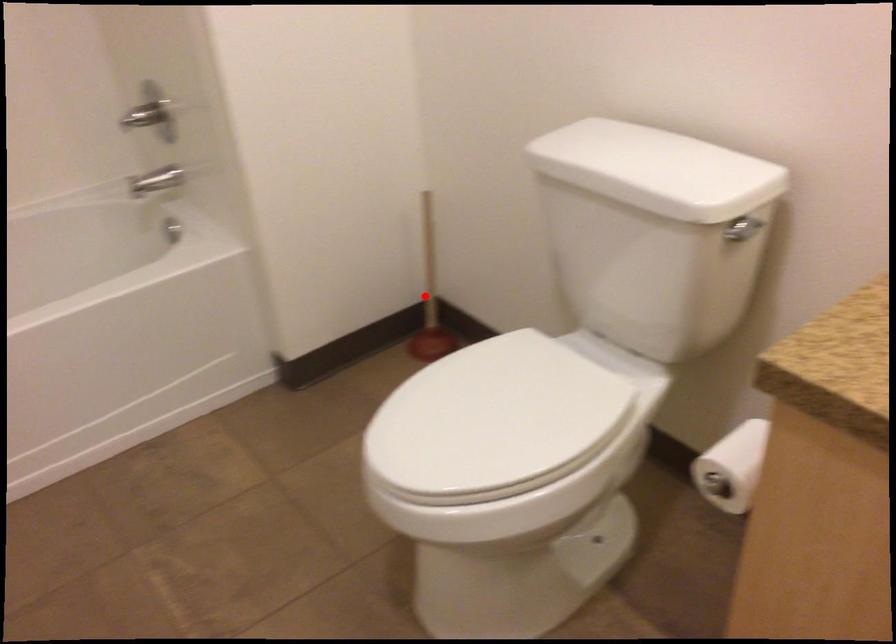
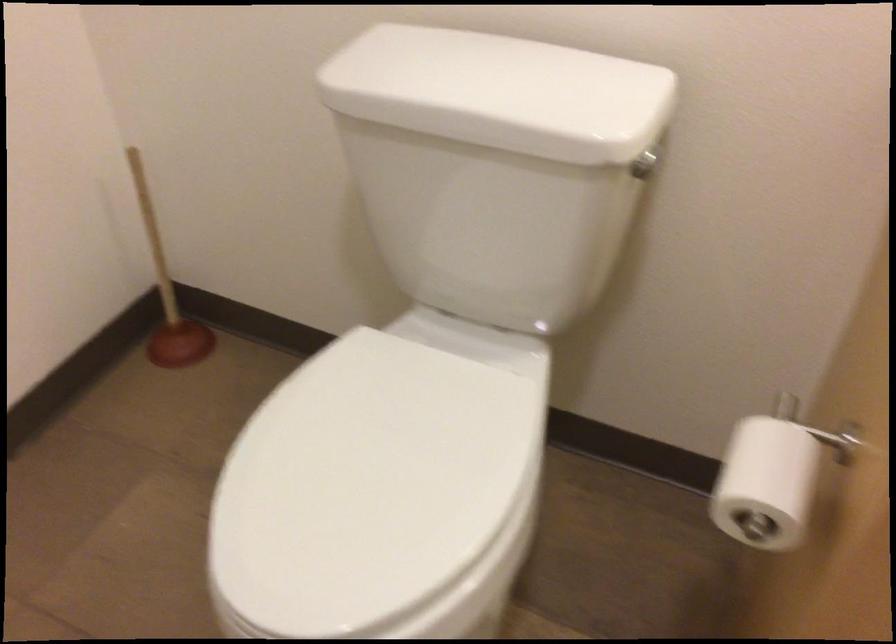
Question: I am providing you with two images of the same scene from different viewpoints. In image1, a red point is highlighted. Considering the same 3D point in image2, which of the following is correct?

Choices:
 (A) It is closer
 (B) It is farther

Answer: (A)